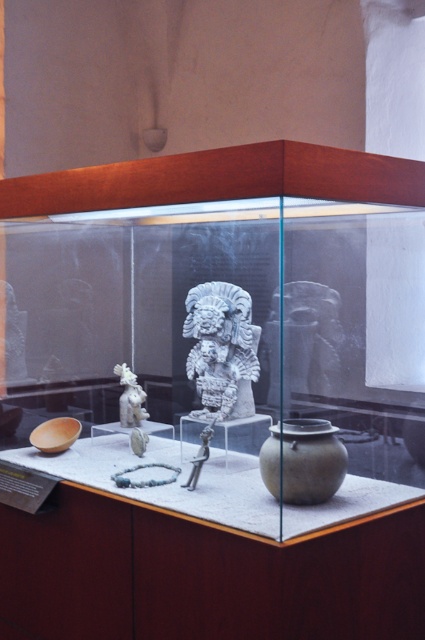
Where is `matte gray vase at center`? Image resolution: width=425 pixels, height=640 pixels. matte gray vase at center is located at coordinates (303, 460).

Is matte gray vase at center wider than metallic figure at center?

Indeed, matte gray vase at center has a greater width compared to metallic figure at center.

Between point (294, 435) and point (207, 449), which one is positioned in front?

Point (294, 435)

This screenshot has height=640, width=425. I want to click on matte gray vase at center, so click(x=303, y=460).

This screenshot has width=425, height=640. Find the location of `white stone sculpture at center`. white stone sculpture at center is located at coordinates (221, 349).

The width and height of the screenshot is (425, 640). Describe the element at coordinates (221, 349) in the screenshot. I see `white stone sculpture at center` at that location.

Locate an element on the screen. The width and height of the screenshot is (425, 640). white stone sculpture at center is located at coordinates (221, 349).

Find the location of a particular element. white stone sculpture at center is located at coordinates (221, 349).

Between white stone sculpture at center and matte gray vase at center, which one has less height?

With less height is matte gray vase at center.

The height and width of the screenshot is (640, 425). Identify the location of white stone sculpture at center. (221, 349).

Find the location of a particular element. The width and height of the screenshot is (425, 640). white stone sculpture at center is located at coordinates (221, 349).

Where is `white stone sculpture at center`? The image size is (425, 640). white stone sculpture at center is located at coordinates (221, 349).